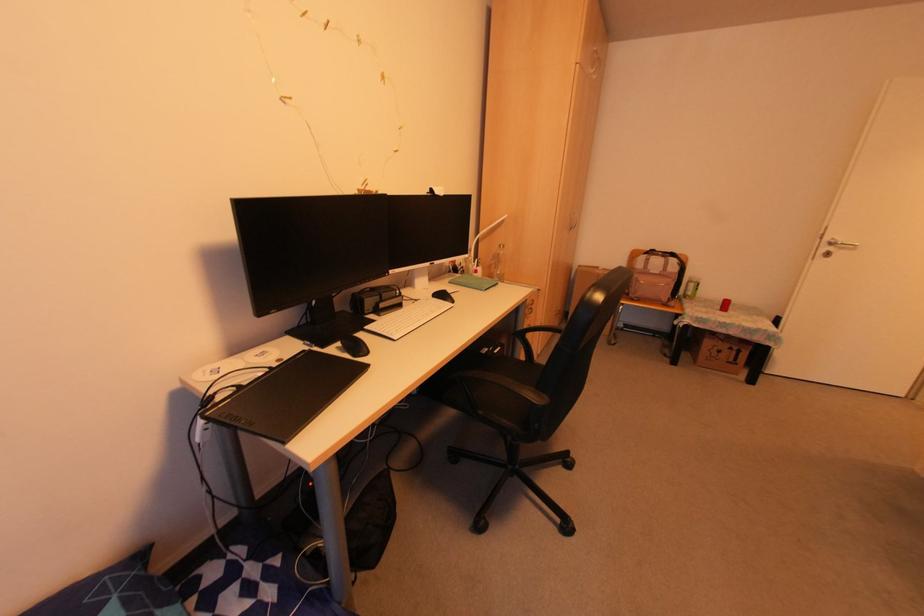
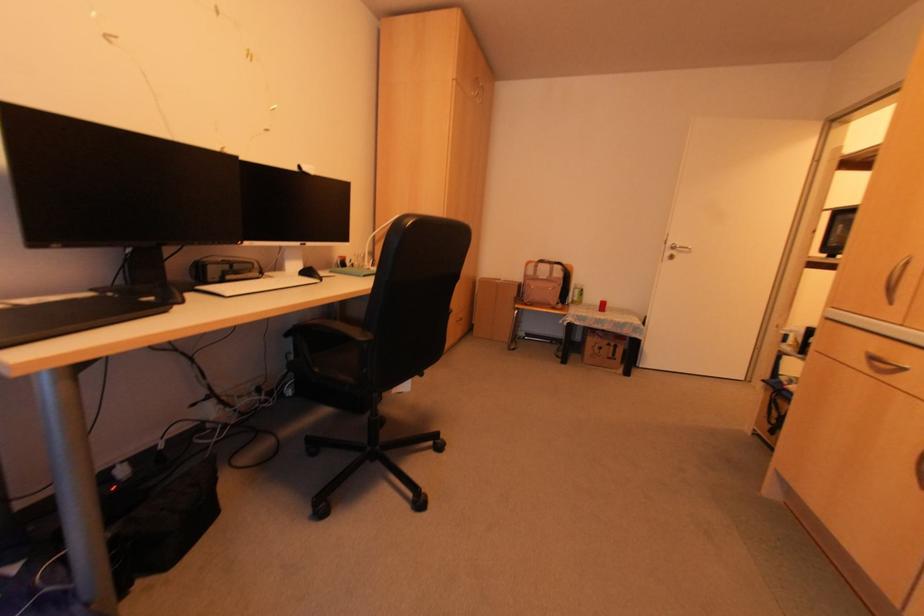
In the second image, find the point that corresponds to point (725, 346) in the first image.

(604, 342)